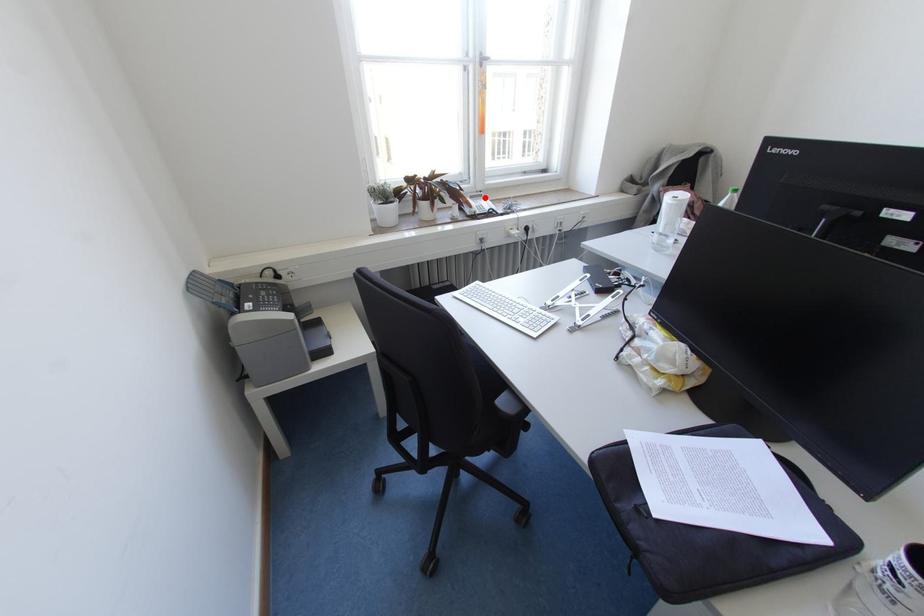
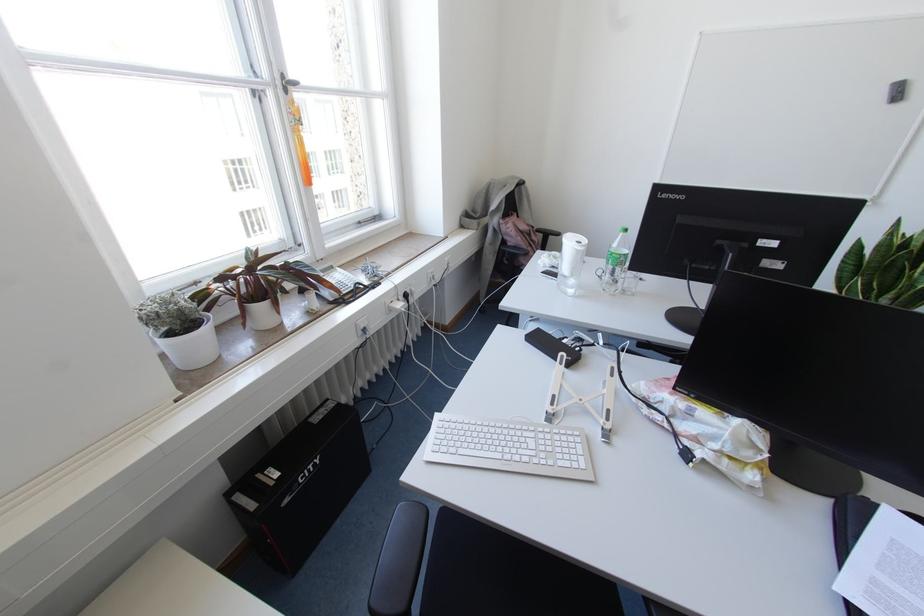
The point at the highlighted location is marked in the first image. Where is the corresponding point in the second image?

(336, 268)